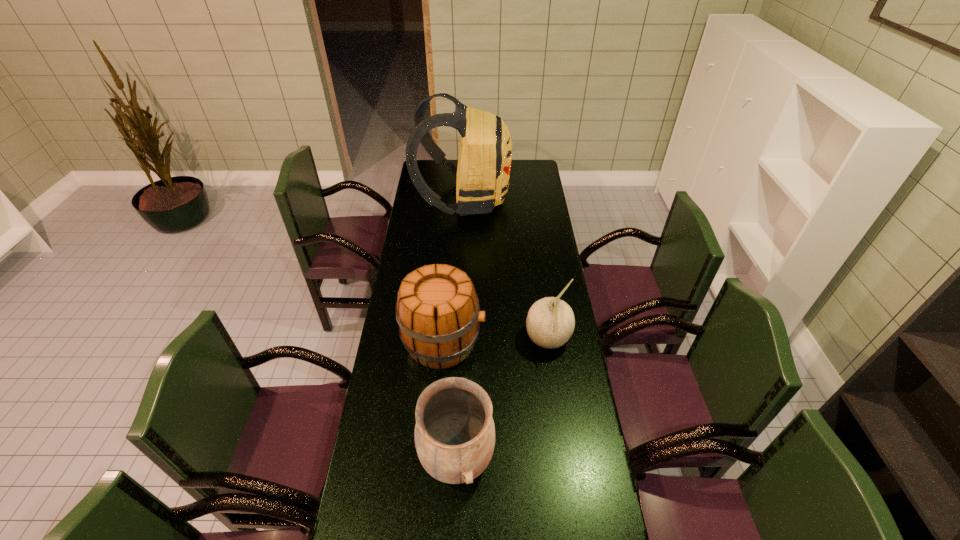
Locate an element on the screen. The height and width of the screenshot is (540, 960). the tallest object is located at coordinates point(485,154).

Image resolution: width=960 pixels, height=540 pixels. I want to click on backpack, so click(485, 154).

Find the location of a particular element. cider is located at coordinates click(x=437, y=309).

Locate an element on the screen. The image size is (960, 540). the nearest object is located at coordinates (454, 434).

This screenshot has width=960, height=540. Identify the location of cantaloup. (550, 322).

Find the location of a particular element. This screenshot has height=540, width=960. vacant space located on the front-facing side of the farthest object is located at coordinates (542, 199).

I want to click on vacant point located on the side of the cider where the spigot is located, so click(x=505, y=342).

I want to click on vacant area situated 0.380m on the back of the urn, so point(462,329).

Locate an element on the screen. This screenshot has width=960, height=540. blank space located on the front of the cantaloup is located at coordinates tap(559, 422).

At what (x,y) coordinates should I click in order to perform the action: click on object present at the far edge. Please return your answer as a coordinate pair (x, y). Looking at the image, I should click on (485, 154).